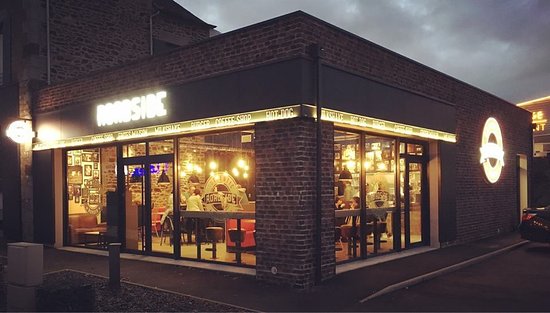
Image resolution: width=550 pixels, height=313 pixels. I want to click on doorway, so click(x=155, y=202), click(x=131, y=204), click(x=409, y=220).